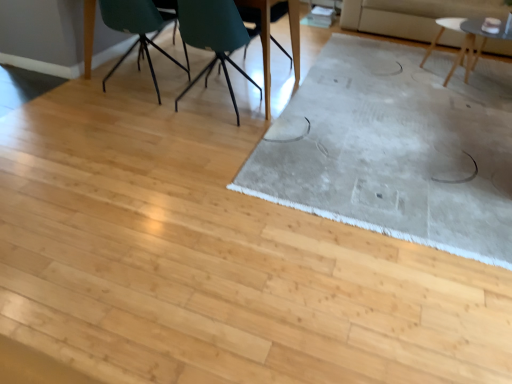
You are a GUI agent. You are given a task and a screenshot of the screen. Output one action in this format:
    pyautogui.click(x=<x>, y=<y>)
    Task: Click on the free spot in front of white glossy table at upper right, which is the 2th table in left-to-right order
    This screenshot has height=384, width=512.
    Given the screenshot: What is the action you would take?
    pyautogui.click(x=461, y=108)